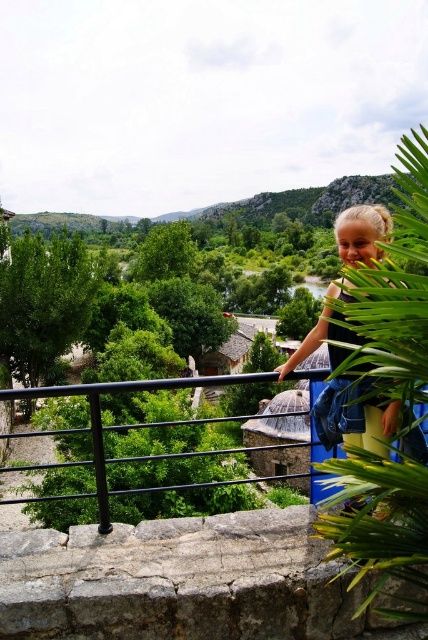
You are standing at the base of a building and looking up at the blonde hair at upper right. If you want to throw a small ball to reach the girl, will the ball need to travel more than 7 meters?

The blonde hair at upper right is 7.35 meters away from the viewer, so yes, the ball will need to travel more than 7 meters to reach the girl.